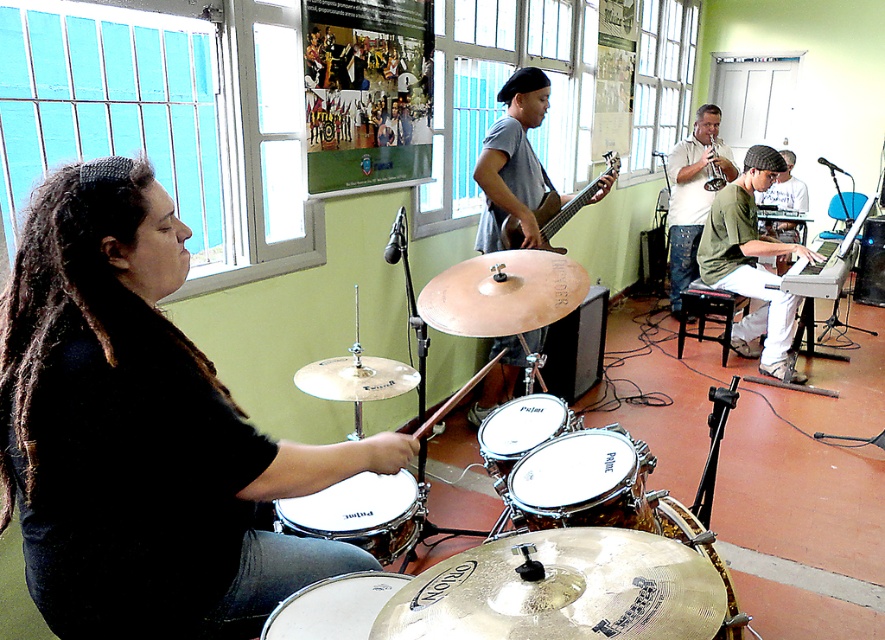
You are standing in the music room and want to place a 6 feet long banner on the wall behind the white drumhead at center. Can you hang the banner so that it is directly behind the drumhead without overlapping it?

The white drumhead at center is 5.92 feet from the viewer. Since the banner is 6 feet long, it would extend beyond the drumhead, so you can hang it directly behind without overlapping.

You are a photographer setting up a shot of the drummer. You need to ensure the white drumhead at center and the gray cotton shirt at center are both in focus. Which object should you adjust your camera focus on first if you want to capture the smaller object clearly?

The white drumhead at center is smaller than the gray cotton shirt at center, so you should focus on the white drumhead at center first to ensure its clarity.